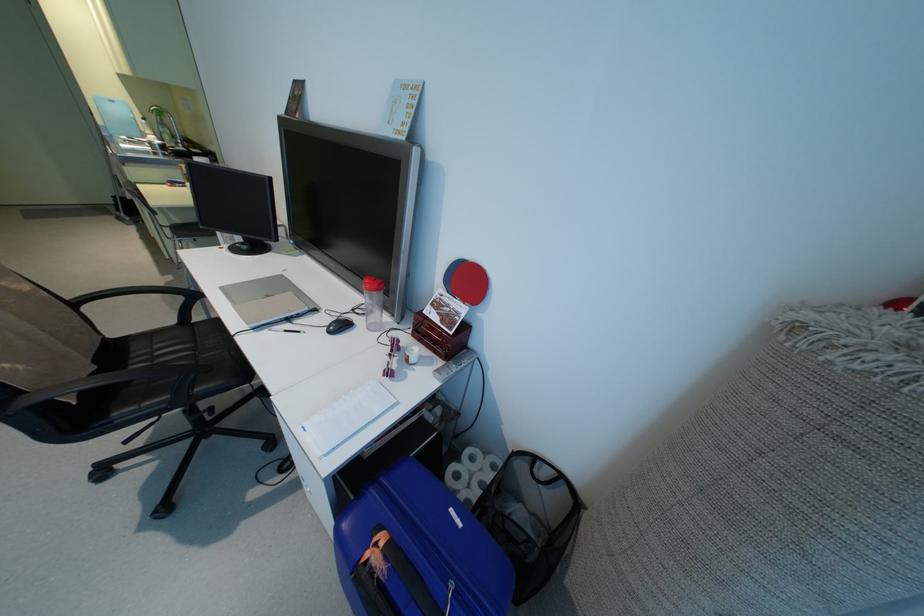
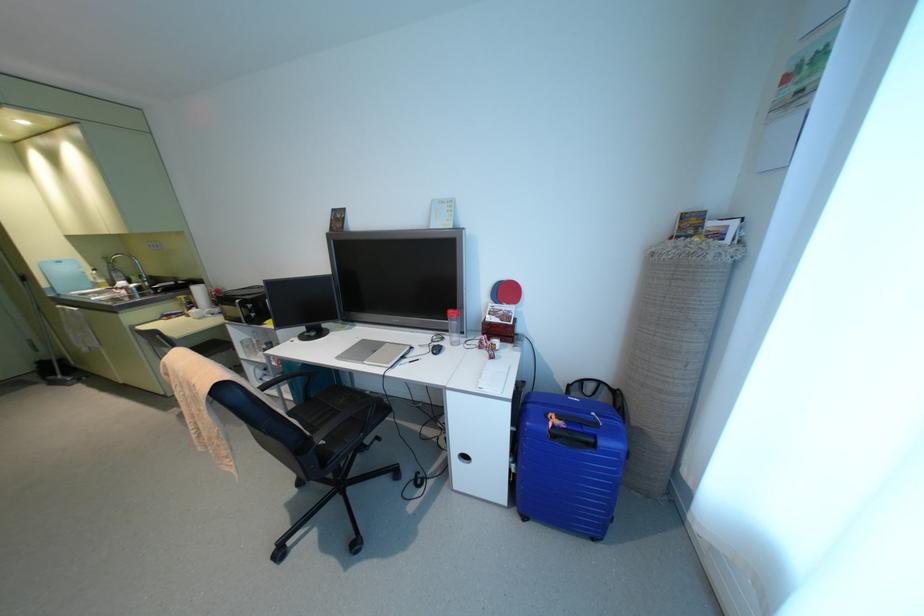
Find the pixel in the second image that matches [305,309] in the first image.

(407, 347)